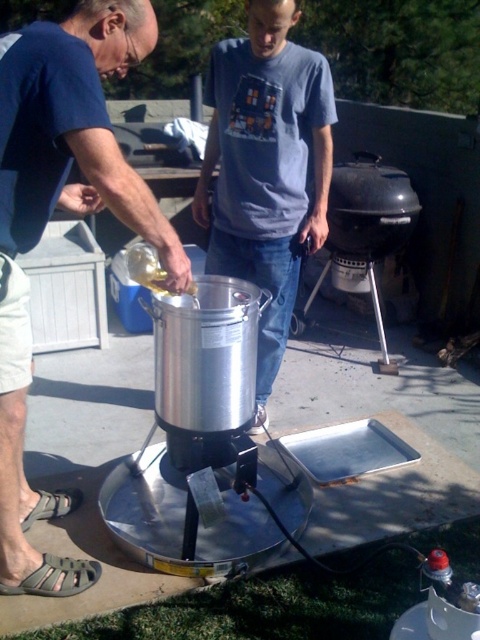
You are a chef preparing a dish and need to know which object is bigger between the brushed metal pot at left and the gray cotton shirt at center. Can you tell me which one is larger?

The brushed metal pot at left has a larger size compared to the gray cotton shirt at center, so the brushed metal pot at left is bigger.

You are standing in the backyard and want to place a small plate on the counter behind you. The counter is at the same height as the gray cotton shirt at center. Can you place the plate on the counter without moving the brushed metal pot at left?

The brushed metal pot at left is located below the gray cotton shirt at center, meaning the pot is lower than the counter. Since the counter is at the same height as the shirt, you can place the plate on the counter without disturbing the pot.

You are a chef preparing a dish and need to know the height of the brushed metal pot at left compared to the gray cotton shirt at center. Which one is taller?

The brushed metal pot at left is shorter than the gray cotton shirt at center, so the gray cotton shirt at center is taller.